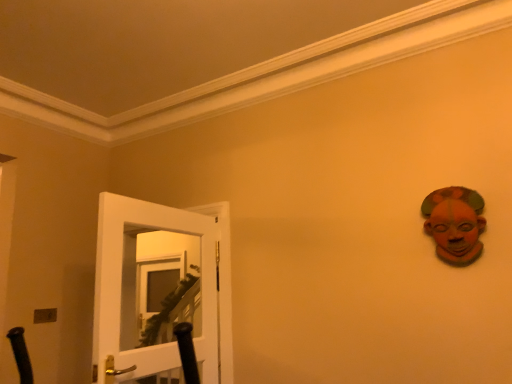
Question: From the image's perspective, does white glossy door at left appear lower than metallic silver light switch at lower left?

Choices:
 (A) yes
 (B) no

Answer: (B)

Question: Is white glossy door at left turned away from metallic silver light switch at lower left?

Choices:
 (A) yes
 (B) no

Answer: (B)

Question: Does white glossy door at left have a smaller size compared to metallic silver light switch at lower left?

Choices:
 (A) yes
 (B) no

Answer: (B)

Question: Is white glossy door at left surrounding metallic silver light switch at lower left?

Choices:
 (A) no
 (B) yes

Answer: (A)

Question: Is white glossy door at left bigger than metallic silver light switch at lower left?

Choices:
 (A) no
 (B) yes

Answer: (B)

Question: Looking at their shapes, would you say white glossy door at left is wider or thinner than metallic silver light switch at lower left?

Choices:
 (A) wide
 (B) thin

Answer: (A)

Question: From the image's perspective, is white glossy door at left positioned above or below metallic silver light switch at lower left?

Choices:
 (A) above
 (B) below

Answer: (A)

Question: Visually, is white glossy door at left positioned to the left or to the right of metallic silver light switch at lower left?

Choices:
 (A) left
 (B) right

Answer: (B)

Question: From a real-world perspective, is white glossy door at left above or below metallic silver light switch at lower left?

Choices:
 (A) above
 (B) below

Answer: (A)

Question: In the image, is metallic silver light switch at lower left positioned in front of or behind white glossy door at left?

Choices:
 (A) front
 (B) behind

Answer: (B)

Question: In terms of width, does metallic silver light switch at lower left look wider or thinner when compared to white glossy door at left?

Choices:
 (A) thin
 (B) wide

Answer: (A)

Question: Is metallic silver light switch at lower left bigger or smaller than white glossy door at left?

Choices:
 (A) small
 (B) big

Answer: (A)

Question: From the image's perspective, is metallic silver light switch at lower left positioned above or below white glossy door at left?

Choices:
 (A) above
 (B) below

Answer: (B)

Question: Based on their positions, is terracotta clay mask at upper right located to the left or right of white glossy door at left?

Choices:
 (A) right
 (B) left

Answer: (A)

Question: From a real-world perspective, is terracotta clay mask at upper right positioned above or below white glossy door at left?

Choices:
 (A) above
 (B) below

Answer: (A)